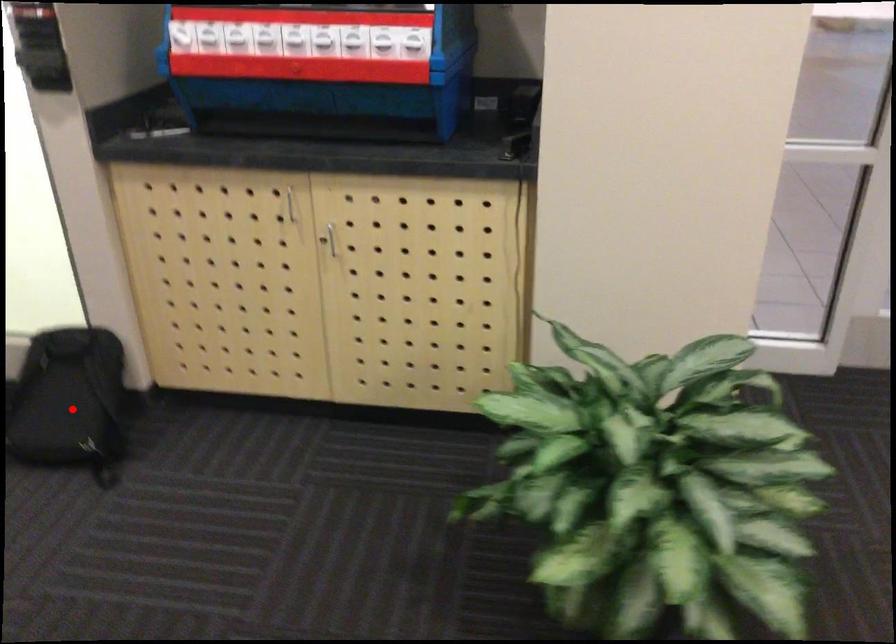
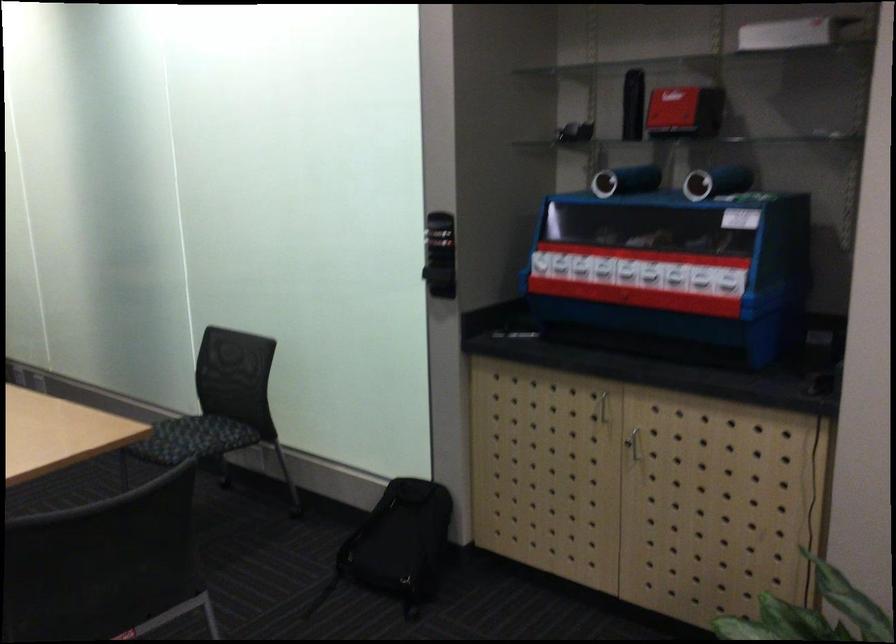
Find the pixel in the second image that matches the highlighted location in the first image.

(398, 545)